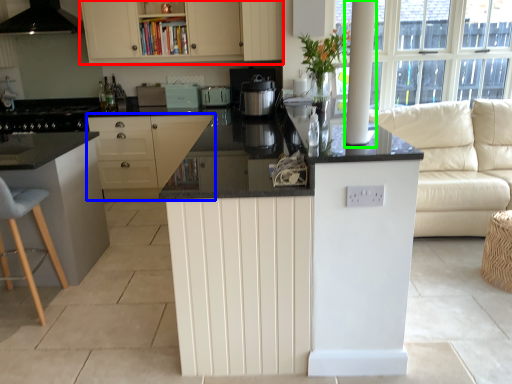
Question: Which object is the farthest from cabinetry (highlighted by a red box)? Choose among these: cabinetry (highlighted by a blue box) or pillar (highlighted by a green box).

Choices:
 (A) cabinetry
 (B) pillar

Answer: (B)